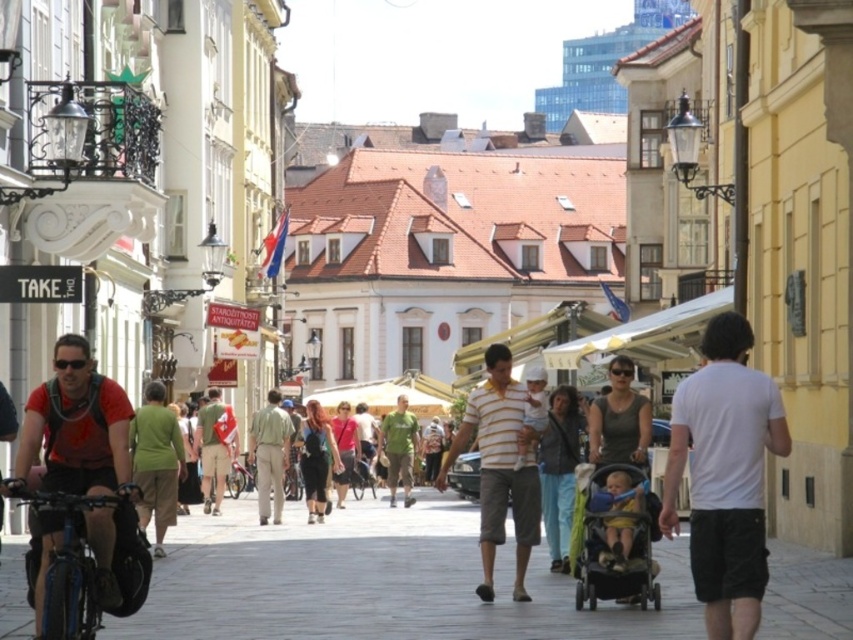
Question: Estimate the real-world distances between objects in this image. Which object is farther from the green matte shirt at center?

Choices:
 (A) blue metallic bicycle at lower left
 (B) white cotton t-shirt at right

Answer: (A)

Question: Is white cotton t-shirt at right in front of blue metallic bicycle at lower left?

Choices:
 (A) yes
 (B) no

Answer: (A)

Question: Does light green fabric shirt at center have a lesser width compared to black matte bicycle helmet at lower left?

Choices:
 (A) no
 (B) yes

Answer: (A)

Question: Which point is farther from the camera taking this photo?

Choices:
 (A) (128, 557)
 (B) (584, 568)
 (C) (492, 502)

Answer: (C)

Question: Can you confirm if black plastic stroller at center is positioned to the right of black matte bicycle helmet at lower left?

Choices:
 (A) no
 (B) yes

Answer: (B)

Question: Which point appears closest to the camera in this image?

Choices:
 (A) (410, 467)
 (B) (65, 570)
 (C) (258, 492)
 (D) (151, 566)

Answer: (B)